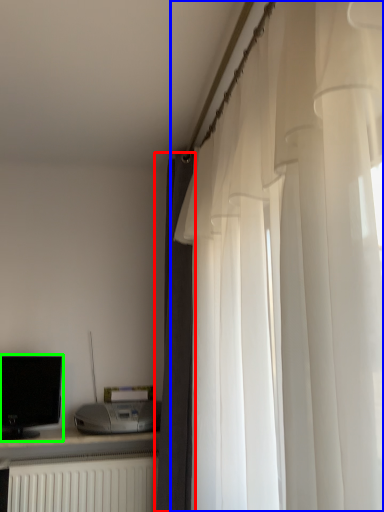
Question: Which is nearer to the curtain (highlighted by a red box)? curtain (highlighted by a blue box) or computer monitor (highlighted by a green box).

Choices:
 (A) curtain
 (B) computer monitor

Answer: (B)